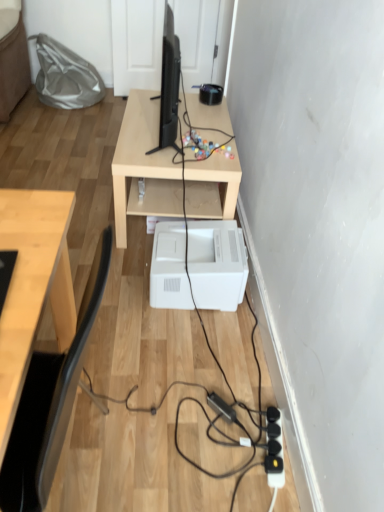
Where is `vacant point above light wood table at center (from a real-world perspective)`? This screenshot has height=512, width=384. vacant point above light wood table at center (from a real-world perspective) is located at coordinates (190, 121).